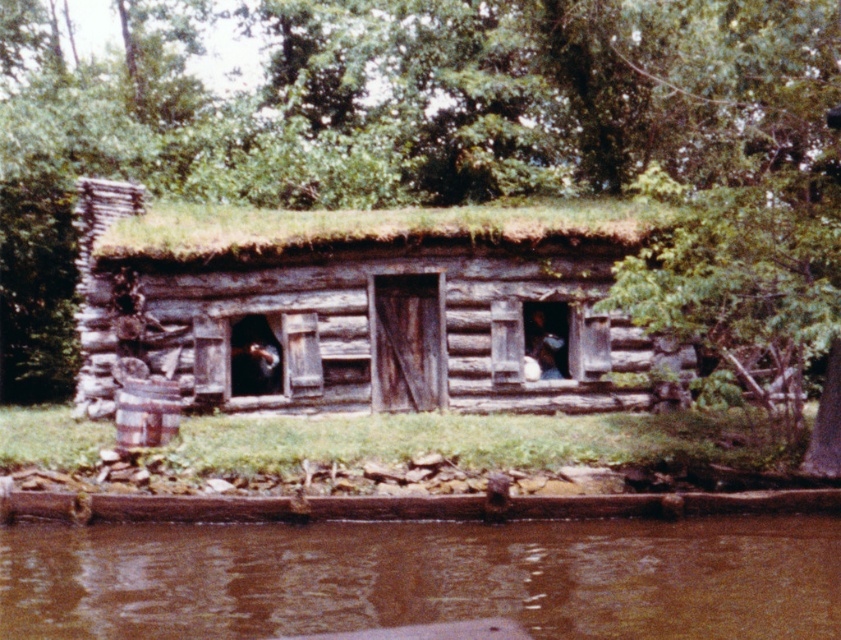
Question: Based on their relative distances, which object is nearer to the brown muddy water at lower center?

Choices:
 (A) green grass at lower center
 (B) green leafy tree at center
 (C) weathered brown wood log cabin at center
 (D) green moss at center

Answer: (A)

Question: Does weathered brown wood log cabin at center have a lesser width compared to green grass at lower center?

Choices:
 (A) yes
 (B) no

Answer: (A)

Question: Is green leafy tree at center thinner than green grass at lower center?

Choices:
 (A) no
 (B) yes

Answer: (A)

Question: Is green leafy tree at center above weathered brown wood log cabin at center?

Choices:
 (A) yes
 (B) no

Answer: (A)

Question: Which of the following is the farthest from the observer?

Choices:
 (A) (498, 102)
 (B) (505, 538)
 (C) (358, 403)
 (D) (262, 432)

Answer: (A)

Question: Which of the following is the farthest from the observer?

Choices:
 (A) (532, 280)
 (B) (186, 166)
 (C) (797, 612)
 (D) (191, 253)

Answer: (B)